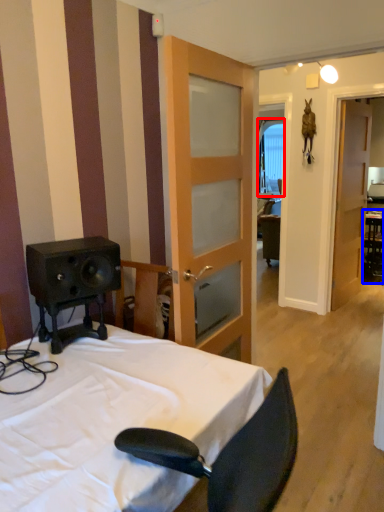
Question: Which point is closer to the camera, window (highlighted by a red box) or table (highlighted by a blue box)?

Choices:
 (A) window
 (B) table

Answer: (B)